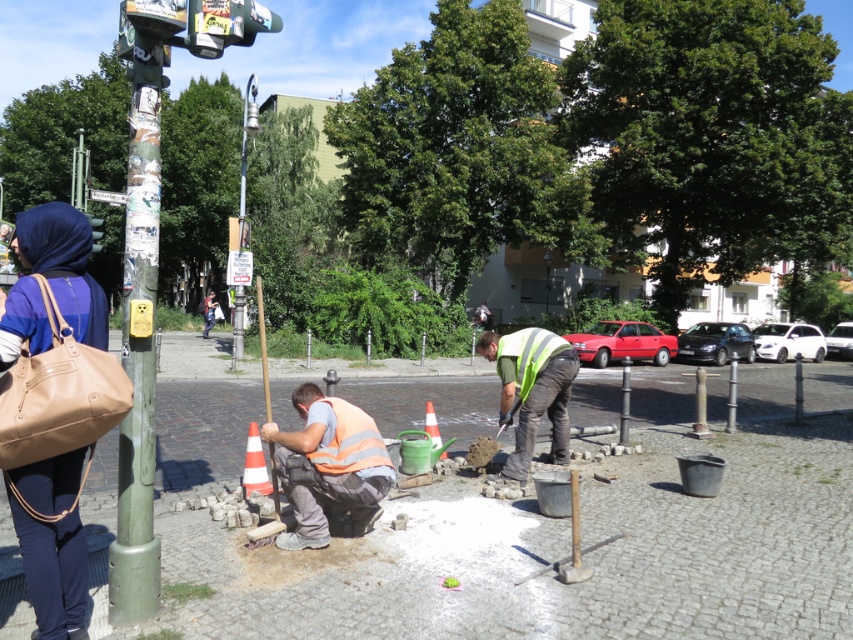
What are the coordinates of the white cobblestone pavement at center?

The coordinates of the white cobblestone pavement at center are at point (541, 534).

Looking at this image, you are a pedestrian walking through the square and notice two workers in safety gear. According to the image, which of the two workers wearing the reflective yellow vest at center and the orange reflective safety vest at lower center is positioned higher from your viewpoint?

The reflective yellow vest at center is positioned higher than the orange reflective safety vest at lower center because it is located above it in the image.

You are a delivery person carrying a package that needs to be placed at the base of the brushed metal lamp post at upper center. You notice a matte brown leather bag at left lying on the ground. If the minimum safe distance required between the delivery and any obstacles is 3 meters, can you safely place your package at the lamp post?

A: The matte brown leather bag at left and brushed metal lamp post at upper center are 38.07 meters apart, which is more than the required 3 meters. Therefore, you can safely place the package at the base of the brushed metal lamp post at upper center.